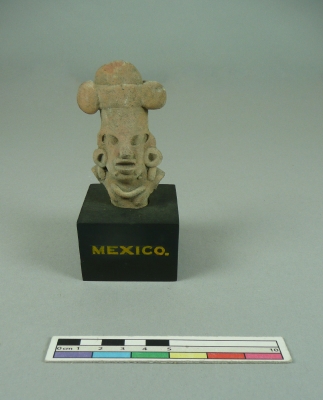
At what (x,y) coordinates should I click in order to perform the action: click on old gray sculpture of a person's bust. Please return your answer as a coordinate pair (x, y). Looking at the image, I should click on (88, 92).